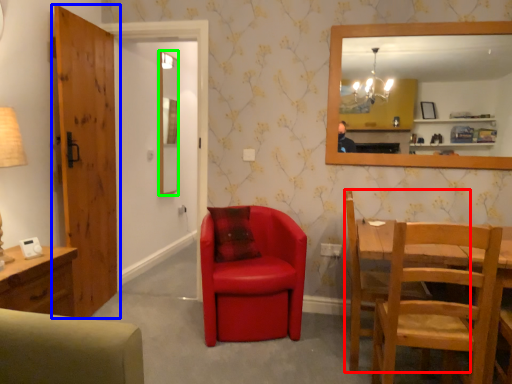
Question: Which object is the closest to the chair (highlighted by a red box)? Choose among these: door (highlighted by a blue box) or mirror (highlighted by a green box).

Choices:
 (A) door
 (B) mirror

Answer: (A)